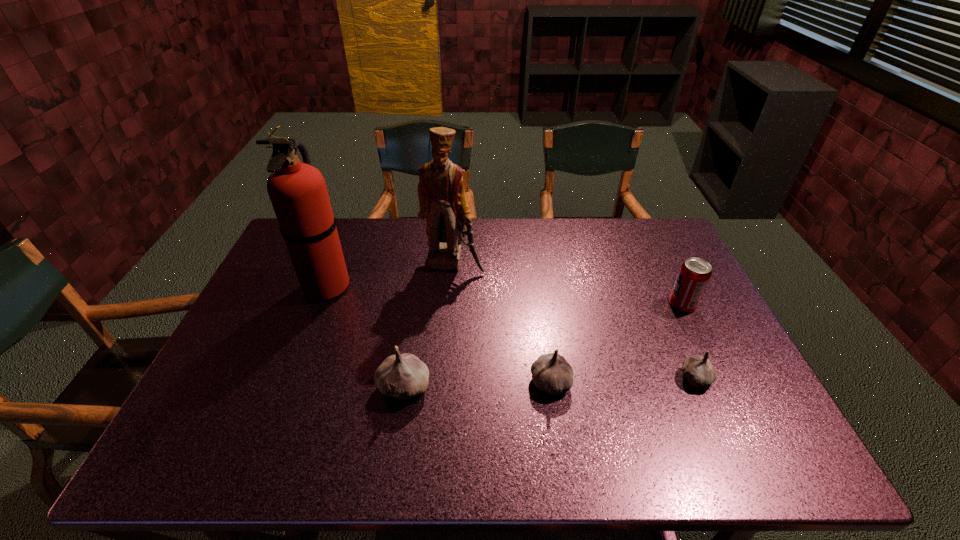
Where is `the tallest garlic`? the tallest garlic is located at coordinates (404, 375).

You are a GUI agent. You are given a task and a screenshot of the screen. Output one action in this format:
    pyautogui.click(x=<x>, y=<y>)
    Task: Click on the second shortest garlic
    Image resolution: width=960 pixels, height=540 pixels.
    Given the screenshot: What is the action you would take?
    pyautogui.click(x=551, y=372)

You are a GUI agent. You are given a task and a screenshot of the screen. Output one action in this format:
    pyautogui.click(x=<x>, y=<y>)
    Task: Click on the second garlic from left to right
    The height and width of the screenshot is (540, 960).
    Given the screenshot: What is the action you would take?
    pyautogui.click(x=551, y=372)

What are the coordinates of `the rightmost garlic` in the screenshot? It's located at (699, 371).

Find the location of a particular element. This screenshot has width=960, height=540. the shortest garlic is located at coordinates (699, 371).

I want to click on soda can, so click(694, 274).

Image resolution: width=960 pixels, height=540 pixels. I want to click on nutcracker, so click(x=442, y=200).

At what (x,y) coordinates should I click in order to perform the action: click on the leftmost object. Please return your answer as a coordinate pair (x, y). The width and height of the screenshot is (960, 540). Looking at the image, I should click on (298, 193).

Locate an element on the screen. This screenshot has width=960, height=540. vacant space located 0.080m on the right of the leftmost garlic is located at coordinates (463, 387).

Locate an element on the screen. The width and height of the screenshot is (960, 540). vacant space located 0.280m on the back of the fifth tallest object is located at coordinates (538, 291).